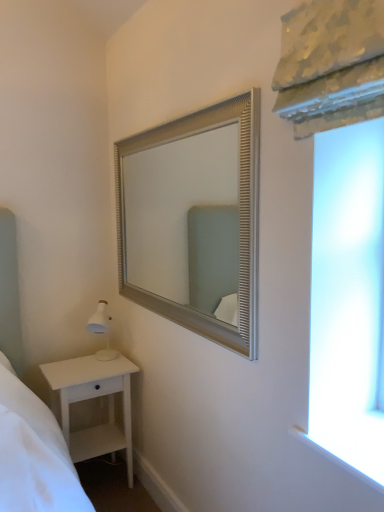
The height and width of the screenshot is (512, 384). I want to click on empty space that is ontop of silver textured mirror at upper center (from a real-world perspective), so click(180, 113).